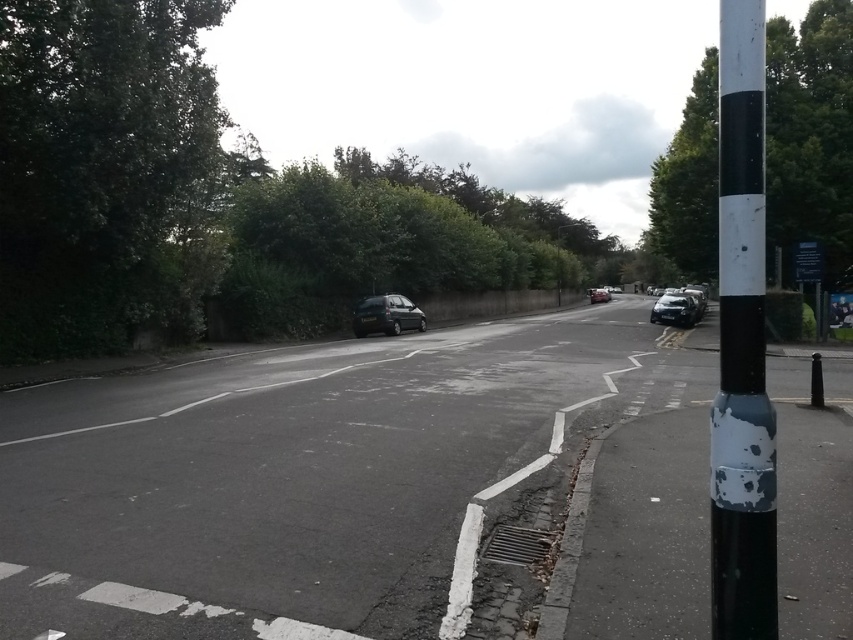
Does shiny black car at center have a lesser height compared to shiny silver car at center?

Yes, shiny black car at center is shorter than shiny silver car at center.

Is point (503, 420) positioned in front of point (593, 298)?

Yes, point (503, 420) is in front of point (593, 298).

This screenshot has width=853, height=640. Find the location of `shiny black car at center`. shiny black car at center is located at coordinates (334, 484).

Find the location of a particular element. The image size is (853, 640). shiny black car at center is located at coordinates (334, 484).

Does shiny black car at center lie in front of green leafy tree at right?

No, shiny black car at center is behind green leafy tree at right.

Which of these two, shiny black car at center or green leafy tree at right, stands shorter?

With less height is shiny black car at center.

Where is `shiny black car at center`? The width and height of the screenshot is (853, 640). shiny black car at center is located at coordinates (334, 484).

Identify the location of shiny black car at center. (334, 484).

Who is more distant from viewer, (0,417) or (820,259)?

The point (820,259) is behind.

Locate an element on the screen. shiny black car at center is located at coordinates (334, 484).